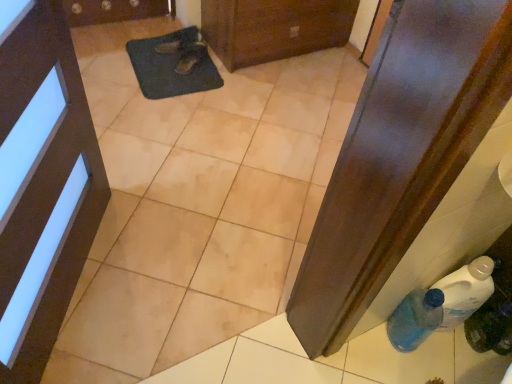
At what (x,y) coordinates should I click in order to perform the action: click on vacant space to the left of blue translucent bottle at lower right, which ranks as the 1th bottle in left-to-right order. Please return your answer as a coordinate pair (x, y). Image resolution: width=512 pixels, height=384 pixels. Looking at the image, I should click on 355,358.